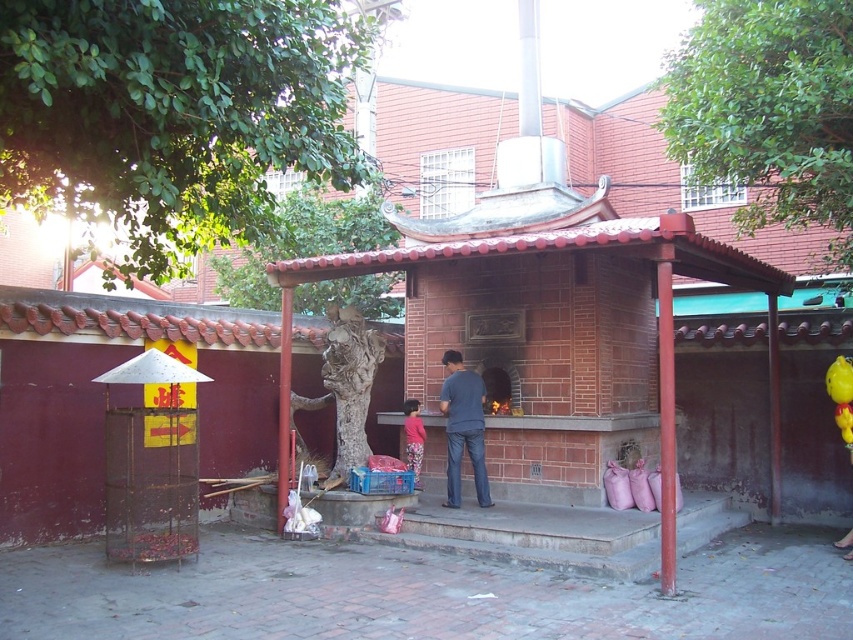
Who is higher up, red brick shrine at center or pink floral pants at center?

Positioned higher is red brick shrine at center.

Is red brick shrine at center shorter than pink floral pants at center?

Indeed, red brick shrine at center has a lesser height compared to pink floral pants at center.

The width and height of the screenshot is (853, 640). I want to click on red brick shrine at center, so click(x=553, y=332).

Who is taller, red brick shrine at center or dark blue jeans at center?

dark blue jeans at center

Is red brick shrine at center positioned behind dark blue jeans at center?

No, it is in front of dark blue jeans at center.

Between point (575, 435) and point (457, 422), which one is positioned in front?

Positioned in front is point (575, 435).

At what (x,y) coordinates should I click in order to perform the action: click on red brick shrine at center. Please return your answer as a coordinate pair (x, y). This screenshot has height=640, width=853. Looking at the image, I should click on (553, 332).

Which of these two, dark blue jeans at center or pink floral pants at center, stands taller?

Standing taller between the two is dark blue jeans at center.

Who is lower down, dark blue jeans at center or pink floral pants at center?

Positioned lower is pink floral pants at center.

Between point (471, 435) and point (418, 417), which one is positioned behind?

The point (418, 417) is behind.

Image resolution: width=853 pixels, height=640 pixels. What are the coordinates of `dark blue jeans at center` in the screenshot? It's located at (463, 428).